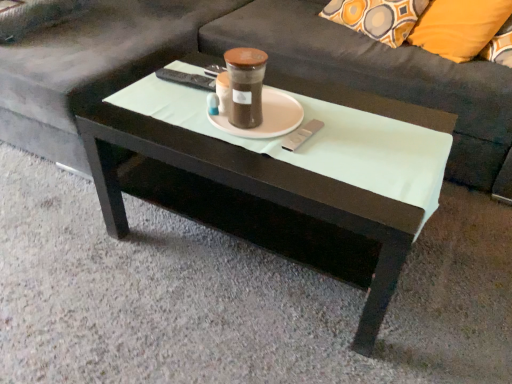
Question: Is white matte saucer at center smaller than orange fabric pillow at upper right?

Choices:
 (A) yes
 (B) no

Answer: (A)

Question: Is white matte saucer at center closer to the viewer compared to orange fabric pillow at upper right?

Choices:
 (A) no
 (B) yes

Answer: (B)

Question: Is white matte saucer at center looking in the opposite direction of orange fabric pillow at upper right?

Choices:
 (A) no
 (B) yes

Answer: (B)

Question: Can you confirm if white matte saucer at center is bigger than orange fabric pillow at upper right?

Choices:
 (A) yes
 (B) no

Answer: (B)

Question: From the image's perspective, is white matte saucer at center located beneath orange fabric pillow at upper right?

Choices:
 (A) no
 (B) yes

Answer: (B)

Question: Considering the relative positions of white matte saucer at center and orange fabric pillow at upper right in the image provided, is white matte saucer at center to the right of orange fabric pillow at upper right from the viewer's perspective?

Choices:
 (A) yes
 (B) no

Answer: (B)

Question: From the image's perspective, is white glossy coffee table at center above orange fabric pillow at upper right?

Choices:
 (A) no
 (B) yes

Answer: (A)

Question: Is white glossy coffee table at center in front of orange fabric pillow at upper right?

Choices:
 (A) yes
 (B) no

Answer: (A)

Question: Does white glossy coffee table at center appear on the left side of orange fabric pillow at upper right?

Choices:
 (A) yes
 (B) no

Answer: (A)

Question: Is white glossy coffee table at center behind orange fabric pillow at upper right?

Choices:
 (A) no
 (B) yes

Answer: (A)

Question: Does white glossy coffee table at center have a lesser width compared to orange fabric pillow at upper right?

Choices:
 (A) no
 (B) yes

Answer: (A)

Question: Can you confirm if white glossy coffee table at center is bigger than orange fabric pillow at upper right?

Choices:
 (A) no
 (B) yes

Answer: (B)

Question: From a real-world perspective, is dark gray fabric couch at center below brown matte glass jar at center?

Choices:
 (A) no
 (B) yes

Answer: (B)